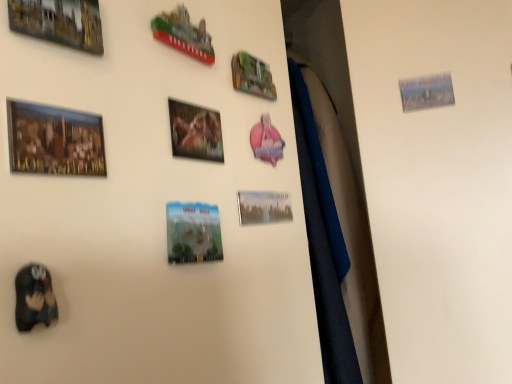
Question: From a real-world perspective, is gold metallic picture frame at upper left, the 8th picture frame when ordered from right to left, positioned above or below matte plastic magnet at center, the 5th picture frame from the left?

Choices:
 (A) below
 (B) above

Answer: (B)

Question: Is point click(x=57, y=14) positioned closer to the camera than point click(x=209, y=210)?

Choices:
 (A) farther
 (B) closer

Answer: (B)

Question: Considering the real-world distances, which object is closest to the metallic green sign at upper center, marked as the 6th picture frame in a left-to-right arrangement?

Choices:
 (A) matte plastic magnet at center, the 5th picture frame from the left
 (B) metallic silver picture frame at center, the seventh picture frame when ordered from left to right
 (C) matte wooden picture frame at upper left, which appears as the seventh picture frame when viewed from the right
 (D) matte black owl at lower left
 (E) gold metallic picture frame at upper left, the 8th picture frame when ordered from right to left

Answer: (B)

Question: Based on their relative distances, which object is nearer to the gold metallic picture frame at upper left, the 8th picture frame when ordered from right to left?

Choices:
 (A) metallic silver photo frame at upper right, which is the 1th picture frame from right to left
 (B) green plastic magnet at upper center, acting as the third picture frame starting from the left
 (C) matte black owl at lower left
 (D) metallic green sign at upper center, placed as the third picture frame when sorted from right to left
 (E) metallic glossy photo frame at center, which is the fourth picture frame from left to right

Answer: (B)